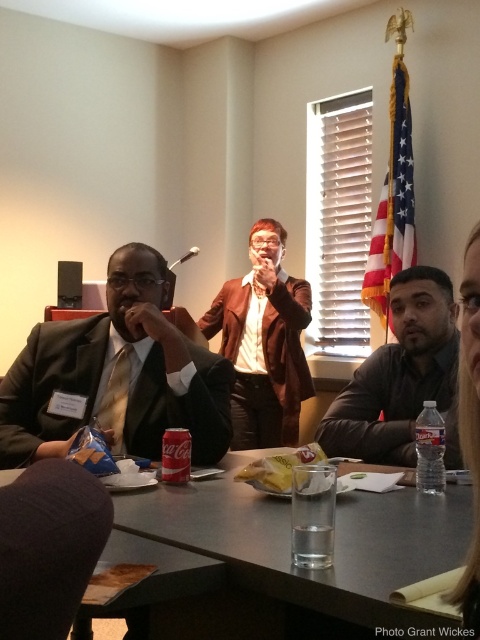
Is point (300, 385) in front of point (479, 282)?

That is False.

Can you confirm if brown leather jacket at center is shorter than smooth brown hair at upper right?

Incorrect, brown leather jacket at center's height does not fall short of smooth brown hair at upper right's.

Find the location of a particular element. brown leather jacket at center is located at coordinates (264, 342).

The width and height of the screenshot is (480, 640). Find the location of `brown leather jacket at center`. brown leather jacket at center is located at coordinates (264, 342).

Does metallic gray table at center have a smaller size compared to dark gray leather jacket at lower right?

Actually, metallic gray table at center might be larger than dark gray leather jacket at lower right.

The image size is (480, 640). I want to click on metallic gray table at center, so click(288, 544).

This screenshot has width=480, height=640. I want to click on metallic gray table at center, so click(x=288, y=544).

In order to click on metallic gray table at center in this screenshot , I will do `click(288, 544)`.

Between dark gray leather jacket at lower right and dark gray fabric at lower left, which one has more height?

dark gray leather jacket at lower right is taller.

Does dark gray leather jacket at lower right come behind dark gray fabric at lower left?

Yes, it is behind dark gray fabric at lower left.

Measure the distance between dark gray leather jacket at lower right and camera.

They are 6.12 feet apart.

Locate an element on the screen. dark gray leather jacket at lower right is located at coordinates (400, 378).